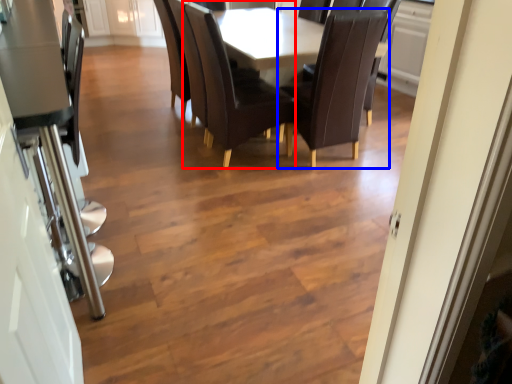
Question: Which of the following is the closest to the observer, chair (highlighted by a red box) or chair (highlighted by a blue box)?

Choices:
 (A) chair
 (B) chair

Answer: (B)